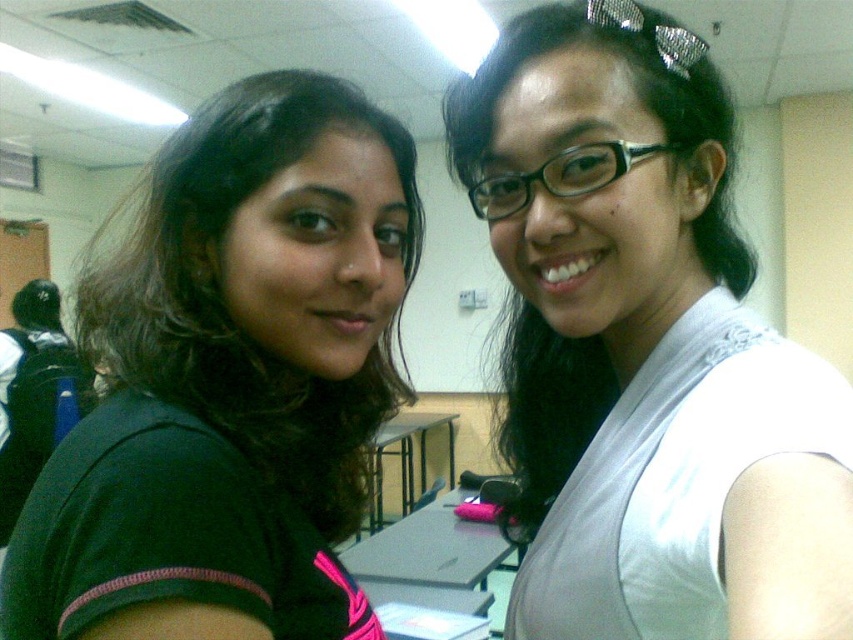
Who is lower down, white matte vest at upper right or dark green fabric shirt at upper left?

Positioned lower is dark green fabric shirt at upper left.

Does white matte vest at upper right appear under dark green fabric shirt at upper left?

No.

Identify the location of white matte vest at upper right. The width and height of the screenshot is (853, 640). (643, 355).